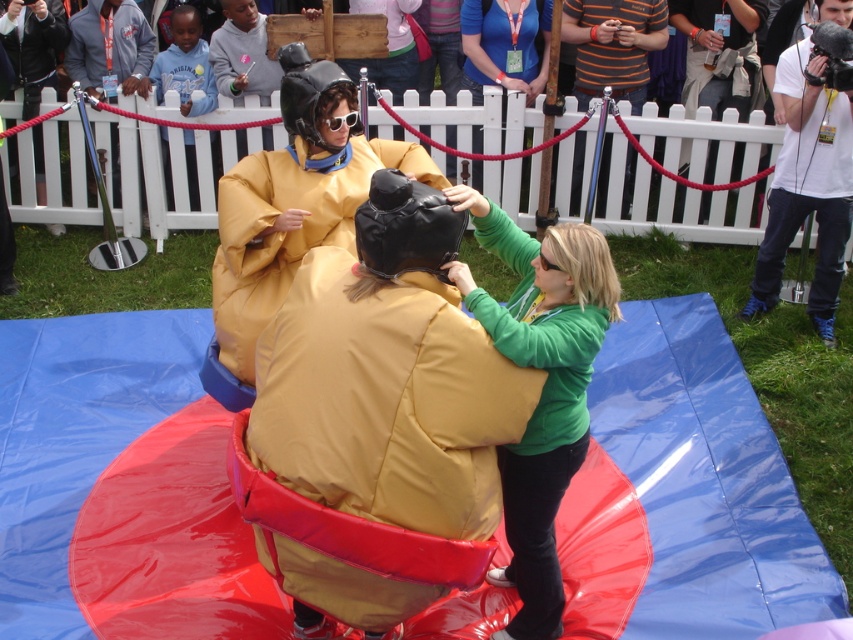
You are standing at the point closest to the bottom left corner of the image. You want to walk towards the point labeled as point (599, 67). However, there is an obstacle at point (541, 1). Will you encounter the obstacle before reaching your destination?

Yes, because point (599, 67) is in front of point (541, 1), so you will pass point (541, 1) before reaching point (599, 67).